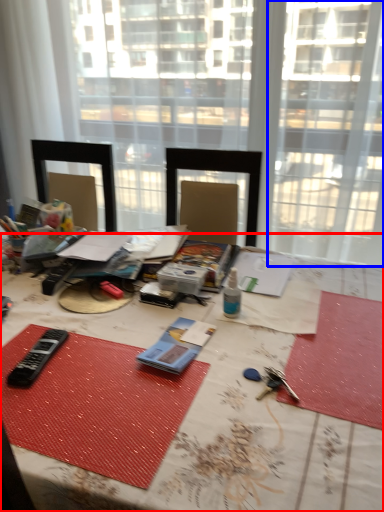
Question: Which object appears closest to the camera in this image, table (highlighted by a red box) or window (highlighted by a blue box)?

Choices:
 (A) table
 (B) window

Answer: (A)